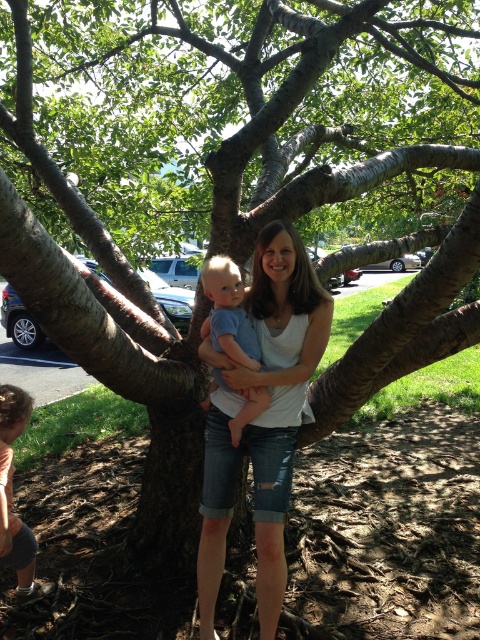
Can you confirm if white cotton shirt at center is positioned below light brown hair at lower left?

No.

Is white cotton shirt at center bigger than light brown hair at lower left?

Yes, white cotton shirt at center is bigger than light brown hair at lower left.

Does point (290, 228) come closer to viewer compared to point (6, 564)?

Yes, point (290, 228) is in front of point (6, 564).

This screenshot has height=640, width=480. I want to click on white cotton shirt at center, so click(264, 419).

Which is more to the right, white cotton shirt at center or blue cotton shirt at center?

white cotton shirt at center is more to the right.

Does point (247, 292) come behind point (260, 401)?

Yes, point (247, 292) is farther from viewer.

Is point (206, 621) positioned behind point (206, 336)?

No.

Locate an element on the screen. This screenshot has height=640, width=480. white cotton shirt at center is located at coordinates tap(264, 419).

Who is positioned more to the right, blue cotton shirt at center or light brown hair at lower left?

Positioned to the right is blue cotton shirt at center.

Which is more to the left, blue cotton shirt at center or light brown hair at lower left?

Positioned to the left is light brown hair at lower left.

Find the location of a particular element. This screenshot has width=480, height=640. blue cotton shirt at center is located at coordinates (228, 312).

Find the location of a particular element. The height and width of the screenshot is (640, 480). blue cotton shirt at center is located at coordinates (228, 312).